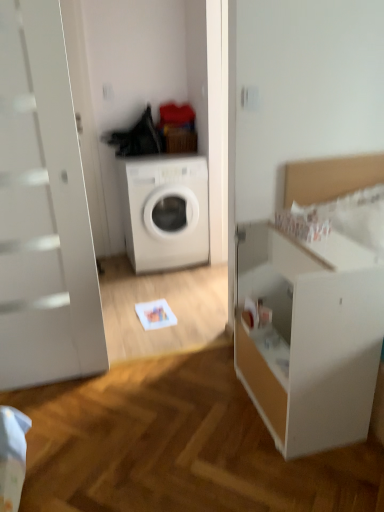
Question: Visually, is white matte washing machine at center positioned to the left or to the right of white matte dresser at right?

Choices:
 (A) left
 (B) right

Answer: (A)

Question: Considering the positions of white matte washing machine at center and white matte dresser at right in the image, is white matte washing machine at center bigger or smaller than white matte dresser at right?

Choices:
 (A) small
 (B) big

Answer: (B)

Question: Would you say white matte washing machine at center is inside or outside white matte dresser at right?

Choices:
 (A) inside
 (B) outside

Answer: (B)

Question: Is point [246, 261] closer or farther from the camera than point [196, 167]?

Choices:
 (A) closer
 (B) farther

Answer: (A)

Question: From a real-world perspective, is white matte dresser at right positioned above or below white matte washing machine at center?

Choices:
 (A) above
 (B) below

Answer: (B)

Question: Visually, is white matte dresser at right positioned to the left or to the right of white matte washing machine at center?

Choices:
 (A) left
 (B) right

Answer: (B)

Question: Relative to white matte washing machine at center, is white matte dresser at right in front or behind?

Choices:
 (A) behind
 (B) front

Answer: (B)